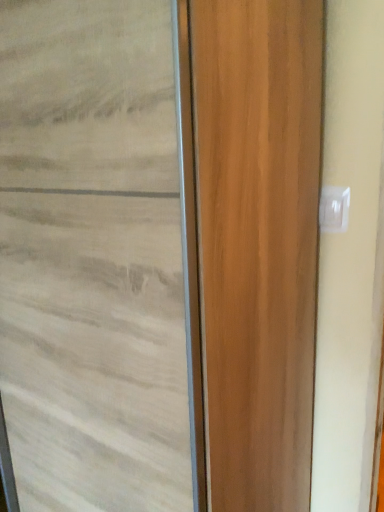
What do you see at coordinates (334, 209) in the screenshot? Image resolution: width=384 pixels, height=512 pixels. I see `white plastic electric outlet at upper right` at bounding box center [334, 209].

Image resolution: width=384 pixels, height=512 pixels. I want to click on white plastic electric outlet at upper right, so pos(334,209).

I want to click on white plastic electric outlet at upper right, so click(334, 209).